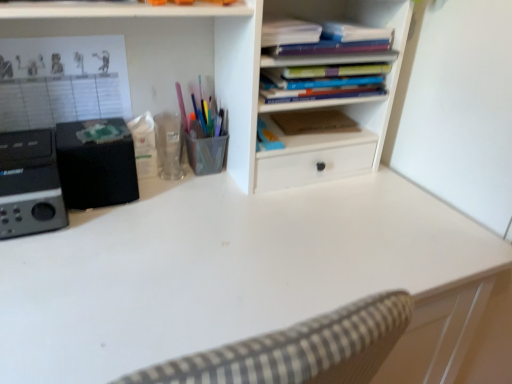
Question: Does hardcover books at upper center, marked as the 1th book in a bottom-to-top arrangement, have a larger size compared to translucent plastic pen holder at center?

Choices:
 (A) no
 (B) yes

Answer: (B)

Question: From a real-world perspective, is hardcover books at upper center, which is the second book from top to bottom, beneath translucent plastic pen holder at center?

Choices:
 (A) no
 (B) yes

Answer: (A)

Question: Can you confirm if hardcover books at upper center, marked as the 1th book in a bottom-to-top arrangement, is smaller than translucent plastic pen holder at center?

Choices:
 (A) yes
 (B) no

Answer: (B)

Question: Can we say hardcover books at upper center, marked as the 1th book in a bottom-to-top arrangement, lies outside translucent plastic pen holder at center?

Choices:
 (A) no
 (B) yes

Answer: (B)

Question: Is translucent plastic pen holder at center located within hardcover books at upper center, which is the second book from top to bottom?

Choices:
 (A) yes
 (B) no

Answer: (B)

Question: Considering the positions of translucent plastic pen holder at center and matte blue notebook at upper center, marked as the second book in a bottom-to-top arrangement, in the image, is translucent plastic pen holder at center taller or shorter than matte blue notebook at upper center, marked as the second book in a bottom-to-top arrangement,?

Choices:
 (A) tall
 (B) short

Answer: (A)

Question: Relative to matte blue notebook at upper center, marked as the second book in a bottom-to-top arrangement, is translucent plastic pen holder at center in front or behind?

Choices:
 (A) behind
 (B) front

Answer: (A)

Question: Is translucent plastic pen holder at center inside or outside of matte blue notebook at upper center, which ranks as the first book in top-to-bottom order?

Choices:
 (A) inside
 (B) outside

Answer: (B)

Question: Based on their positions, is translucent plastic pen holder at center located to the left or right of matte blue notebook at upper center, which ranks as the first book in top-to-bottom order?

Choices:
 (A) right
 (B) left

Answer: (B)

Question: From a real-world perspective, relative to hardcover books at upper center, which is the second book from top to bottom, is translucent plastic pen holder at center vertically above or below?

Choices:
 (A) above
 (B) below

Answer: (B)

Question: In the image, is translucent plastic pen holder at center positioned in front of or behind hardcover books at upper center, marked as the 1th book in a bottom-to-top arrangement?

Choices:
 (A) behind
 (B) front

Answer: (A)

Question: Does point (219, 160) appear closer or farther from the camera than point (307, 89)?

Choices:
 (A) closer
 (B) farther

Answer: (B)

Question: Would you say translucent plastic pen holder at center is to the left or to the right of hardcover books at upper center, marked as the 1th book in a bottom-to-top arrangement, in the picture?

Choices:
 (A) right
 (B) left

Answer: (B)

Question: In terms of height, does white matte desk at center look taller or shorter compared to hardcover books at upper center, which is the second book from top to bottom?

Choices:
 (A) tall
 (B) short

Answer: (A)

Question: From a real-world perspective, is white matte desk at center physically located above or below hardcover books at upper center, which is the second book from top to bottom?

Choices:
 (A) above
 (B) below

Answer: (B)